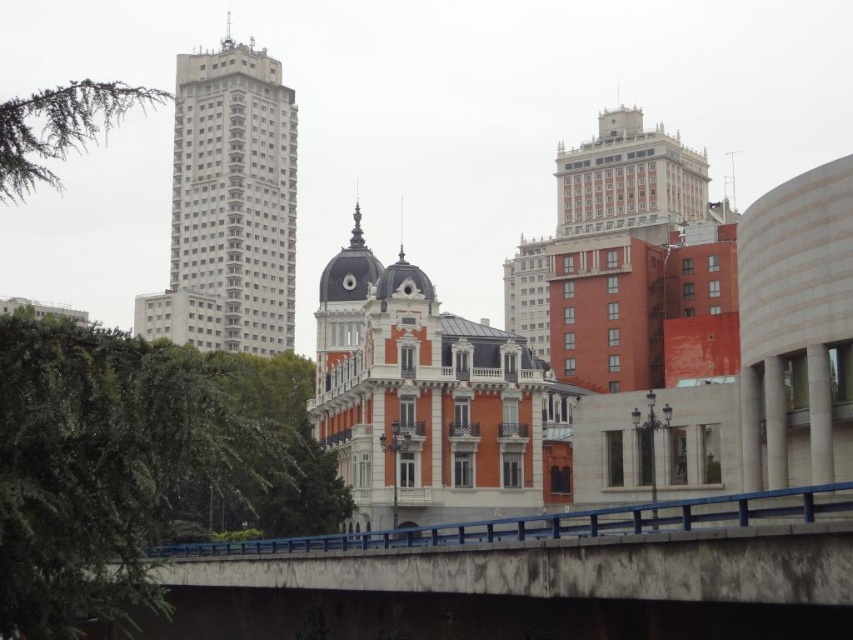
Question: Which object is the farthest from the blue concrete bridge at lower center?

Choices:
 (A) green leafy tree at lower left
 (B) green needle-like leaves at upper left

Answer: (B)

Question: Which point appears farthest from the camera in this image?

Choices:
 (A) (195, 131)
 (B) (68, 145)
 (C) (706, 524)
 (D) (250, 492)

Answer: (A)

Question: Does blue concrete bridge at lower center have a lesser width compared to green leafy tree at lower left?

Choices:
 (A) yes
 (B) no

Answer: (B)

Question: Estimate the real-world distances between objects in this image. Which object is farther from the green needle-like leaves at upper left?

Choices:
 (A) green leafy tree at lower left
 (B) blue concrete bridge at lower center

Answer: (B)

Question: Can you confirm if green leafy tree at lower left is positioned above white smooth tower at upper left?

Choices:
 (A) yes
 (B) no

Answer: (B)

Question: Does blue concrete bridge at lower center appear on the left side of green leafy tree at lower left?

Choices:
 (A) yes
 (B) no

Answer: (B)